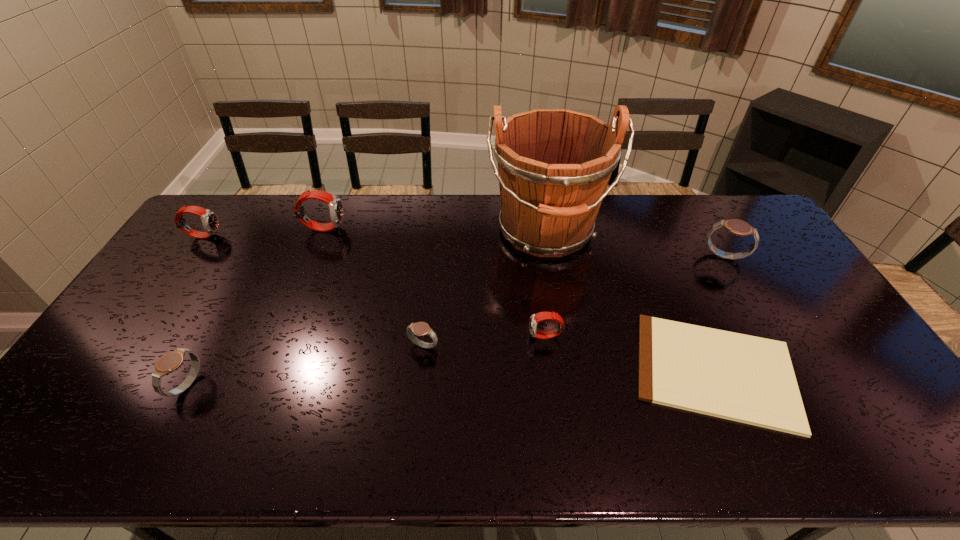
This screenshot has width=960, height=540. In order to click on vacant region at the near edge in this screenshot , I will do `click(524, 427)`.

Image resolution: width=960 pixels, height=540 pixels. What are the coordinates of `vacant space at the right edge` in the screenshot? It's located at (825, 375).

Where is `free space at the near left corner of the desktop`? free space at the near left corner of the desktop is located at coordinates (30, 444).

Where is `free space between the rightmost gray watch and the nearest red watch`? free space between the rightmost gray watch and the nearest red watch is located at coordinates click(635, 296).

You are a GUI agent. You are given a task and a screenshot of the screen. Output one action in this format:
    pyautogui.click(x=<x>, y=<y>)
    Task: Click on the free space between the rightmost watch and the second watch from right to left
    
    Given the screenshot: What is the action you would take?
    pyautogui.click(x=635, y=296)

Where is `vacant space in between the second smallest red watch and the smallest red watch`? Image resolution: width=960 pixels, height=540 pixels. vacant space in between the second smallest red watch and the smallest red watch is located at coordinates (374, 286).

This screenshot has height=540, width=960. What are the coordinates of `blank region between the tallest object and the leftmost gray watch` in the screenshot? It's located at (368, 308).

This screenshot has width=960, height=540. I want to click on vacant point located between the rightmost gray watch and the smallest red watch, so click(635, 296).

You are a GUI agent. You are given a task and a screenshot of the screen. Output one action in this format:
    pyautogui.click(x=<x>, y=<y>)
    Task: Click on the free spot between the third object from left to right and the second watch from right to left
    
    Given the screenshot: What is the action you would take?
    pyautogui.click(x=435, y=282)

You are a GUI agent. You are given a task and a screenshot of the screen. Output one action in this format:
    pyautogui.click(x=<x>, y=<y>)
    Task: Click on the vacant region between the smallest red watch and the tallest object
    The image size is (960, 540).
    Given the screenshot: What is the action you would take?
    pyautogui.click(x=545, y=284)